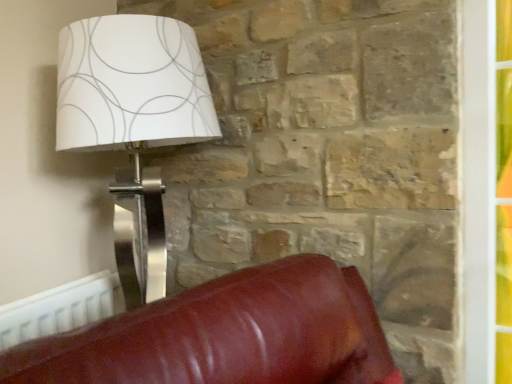
Where is `white plastic radiator at lower left`? This screenshot has width=512, height=384. white plastic radiator at lower left is located at coordinates (60, 309).

What do you see at coordinates (60, 309) in the screenshot?
I see `white plastic radiator at lower left` at bounding box center [60, 309].

Where is `white paper lampshade at upper left`? Image resolution: width=512 pixels, height=384 pixels. white paper lampshade at upper left is located at coordinates (133, 123).

What do you see at coordinates (133, 123) in the screenshot? The image size is (512, 384). I see `white paper lampshade at upper left` at bounding box center [133, 123].

You are a GUI agent. You are given a task and a screenshot of the screen. Output one action in this format:
    pyautogui.click(x=<x>, y=<y>)
    Task: Click on the white plastic radiator at lower left
    The height and width of the screenshot is (384, 512).
    Given the screenshot: What is the action you would take?
    pyautogui.click(x=60, y=309)

Considering the relative positions of white paper lampshade at upper left and white plastic radiator at lower left in the image provided, is white paper lampshade at upper left to the right of white plastic radiator at lower left from the viewer's perspective?

Yes.

Which object is further away from the camera taking this photo, white paper lampshade at upper left or white plastic radiator at lower left?

white plastic radiator at lower left is more distant.

Between point (167, 43) and point (33, 331), which one is positioned in front?

The point (167, 43) is closer to the camera.

From the image's perspective, does white paper lampshade at upper left appear lower than white plastic radiator at lower left?

Actually, white paper lampshade at upper left appears above white plastic radiator at lower left in the image.

From a real-world perspective, is white paper lampshade at upper left physically below white plastic radiator at lower left?

Incorrect, from a real-world perspective, white paper lampshade at upper left is higher than white plastic radiator at lower left.

Can you confirm if white paper lampshade at upper left is thinner than white plastic radiator at lower left?

No, white paper lampshade at upper left is not thinner than white plastic radiator at lower left.

Which of these two, white paper lampshade at upper left or white plastic radiator at lower left, stands shorter?

Standing shorter between the two is white plastic radiator at lower left.

Considering the sizes of white paper lampshade at upper left and white plastic radiator at lower left in the image, is white paper lampshade at upper left bigger or smaller than white plastic radiator at lower left?

Clearly, white paper lampshade at upper left is larger in size than white plastic radiator at lower left.

Does white paper lampshade at upper left contain white plastic radiator at lower left?

Yes, white plastic radiator at lower left can be found within white paper lampshade at upper left.

Based on the photo, can you see white paper lampshade at upper left touching white plastic radiator at lower left?

white paper lampshade at upper left and white plastic radiator at lower left are clearly separated.

Is white paper lampshade at upper left aimed at white plastic radiator at lower left?

No, white paper lampshade at upper left is not turned towards white plastic radiator at lower left.

Locate an element on the screen. The image size is (512, 384). lamp in front of the white plastic radiator at lower left is located at coordinates (133, 123).

Can you confirm if white plastic radiator at lower left is positioned to the left of white paper lampshade at upper left?

Yes.

Is the depth of white plastic radiator at lower left less than that of white paper lampshade at upper left?

No, white plastic radiator at lower left is further to the viewer.

Considering the positions of point (82, 302) and point (86, 21), is point (82, 302) closer or farther from the camera than point (86, 21)?

Point (82, 302).

From the image's perspective, is white plastic radiator at lower left on white paper lampshade at upper left?

Actually, white plastic radiator at lower left appears below white paper lampshade at upper left in the image.

From a real-world perspective, is white plastic radiator at lower left positioned under white paper lampshade at upper left based on gravity?

Yes, from a real-world perspective, white plastic radiator at lower left is below white paper lampshade at upper left.

Which object is wider, white plastic radiator at lower left or white paper lampshade at upper left?

white paper lampshade at upper left is wider.

Does white plastic radiator at lower left have a lesser height compared to white paper lampshade at upper left?

Yes.

Consider the image. Looking at the image, does white plastic radiator at lower left seem bigger or smaller compared to white paper lampshade at upper left?

In the image, white plastic radiator at lower left appears to be smaller than white paper lampshade at upper left.

Choose the correct answer: Is white plastic radiator at lower left inside white paper lampshade at upper left or outside it?

white plastic radiator at lower left cannot be found inside white paper lampshade at upper left.

Is white plastic radiator at lower left far away from white paper lampshade at upper left?

No, white plastic radiator at lower left is not far from white paper lampshade at upper left.

Is white plastic radiator at lower left oriented towards white paper lampshade at upper left?

Yes, white plastic radiator at lower left is turned towards white paper lampshade at upper left.

I want to click on radiator located underneath the white paper lampshade at upper left (from a real-world perspective), so click(60, 309).

Locate an element on the screen. lamp that appears above the white plastic radiator at lower left (from the image's perspective) is located at coordinates (133, 123).

Locate an element on the screen. The width and height of the screenshot is (512, 384). lamp that appears above the white plastic radiator at lower left (from a real-world perspective) is located at coordinates (133, 123).